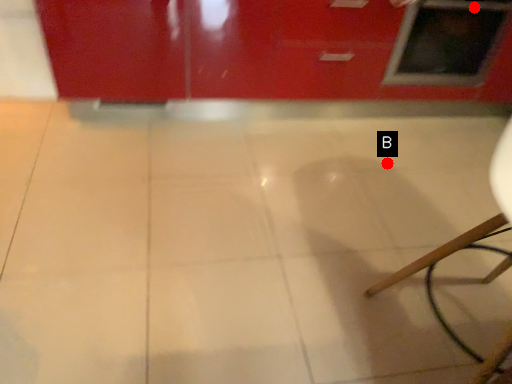
Question: Two points are circled on the image, labeled by A and B beside each circle. Which point is farther from the camera taking this photo?

Choices:
 (A) A is further
 (B) B is further

Answer: (B)